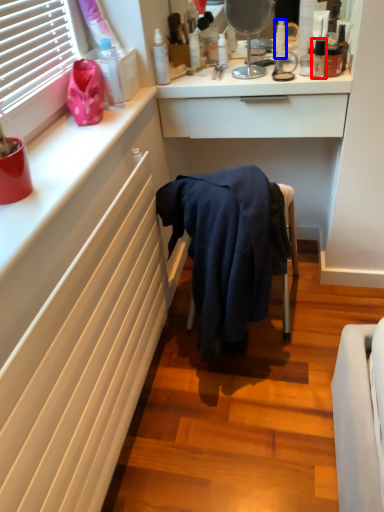
Question: Which object is closer to the camera taking this photo, toiletry (highlighted by a red box) or toiletry (highlighted by a blue box)?

Choices:
 (A) toiletry
 (B) toiletry

Answer: (A)